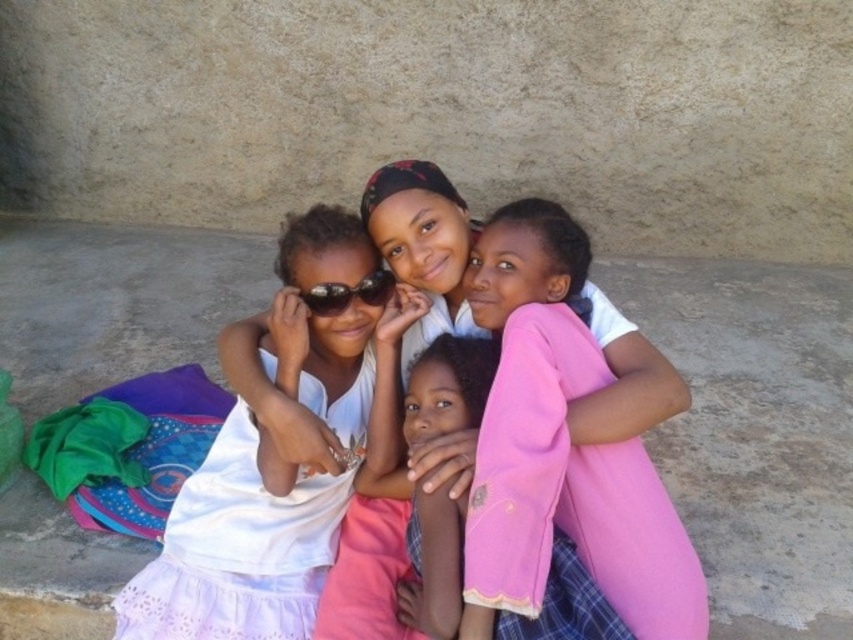
Who is taller, white lace dress at lower left or sunglasses at center?

white lace dress at lower left is taller.

Can you confirm if white lace dress at lower left is taller than sunglasses at center?

Indeed, white lace dress at lower left has a greater height compared to sunglasses at center.

Between point (195, 584) and point (344, 300), which one is positioned in front?

Point (344, 300) is in front.

You are a GUI agent. You are given a task and a screenshot of the screen. Output one action in this format:
    pyautogui.click(x=<x>, y=<y>)
    Task: Click on the white lace dress at lower left
    The width and height of the screenshot is (853, 640).
    Given the screenshot: What is the action you would take?
    pyautogui.click(x=236, y=548)

Between point (143, 598) and point (601, 609), which one is positioned in front?

Point (601, 609) is in front.

Does point (241, 618) come in front of point (444, 348)?

Yes, point (241, 618) is closer to viewer.

Where is `white lace dress at lower left`? The width and height of the screenshot is (853, 640). white lace dress at lower left is located at coordinates (236, 548).

Is the position of pink fleece jacket at center less distant than that of sunglasses at center?

Yes, pink fleece jacket at center is in front of sunglasses at center.

What do you see at coordinates (433, 564) in the screenshot?
I see `pink fleece jacket at center` at bounding box center [433, 564].

This screenshot has height=640, width=853. Identify the location of pink fleece jacket at center. (433, 564).

The height and width of the screenshot is (640, 853). In order to click on pink fleece jacket at center in this screenshot , I will do `click(433, 564)`.